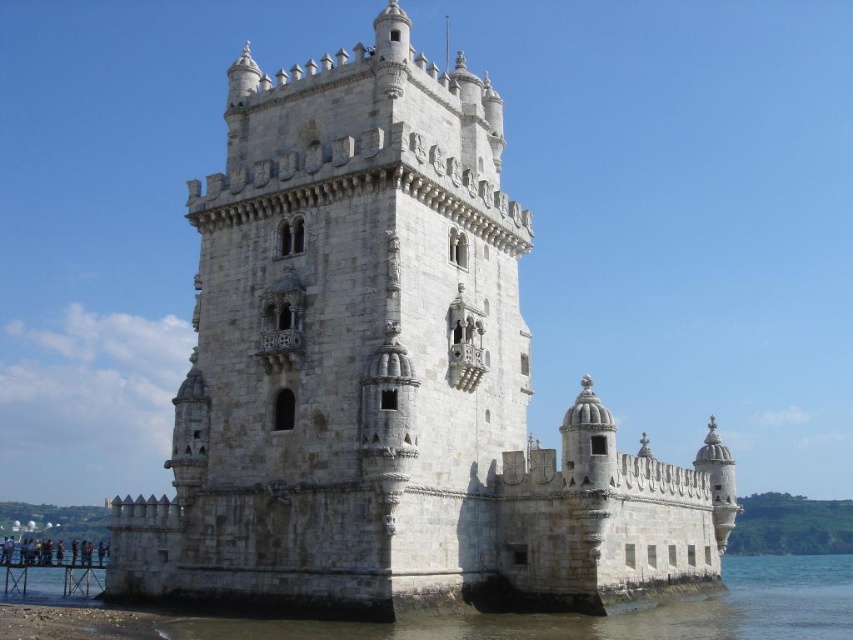
Does white stone castle at center have a greater height compared to clear water at lower left?

Correct, white stone castle at center is much taller as clear water at lower left.

Between white stone castle at center and clear water at lower left, which one appears on the right side from the viewer's perspective?

Positioned to the right is clear water at lower left.

Is point (117, 579) positioned before point (805, 579)?

Yes, it is.

Find the location of `white stone castle at center`. white stone castle at center is located at coordinates (387, 376).